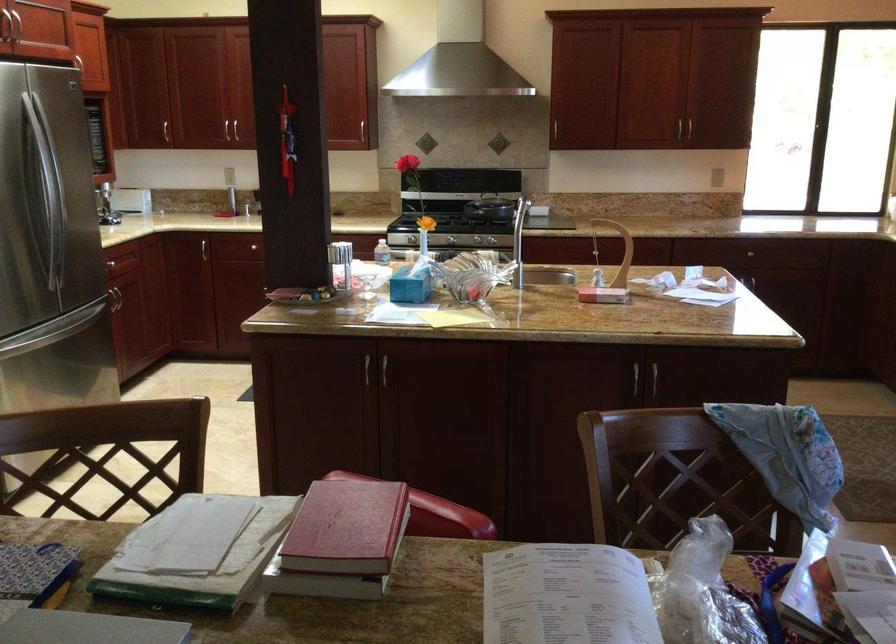
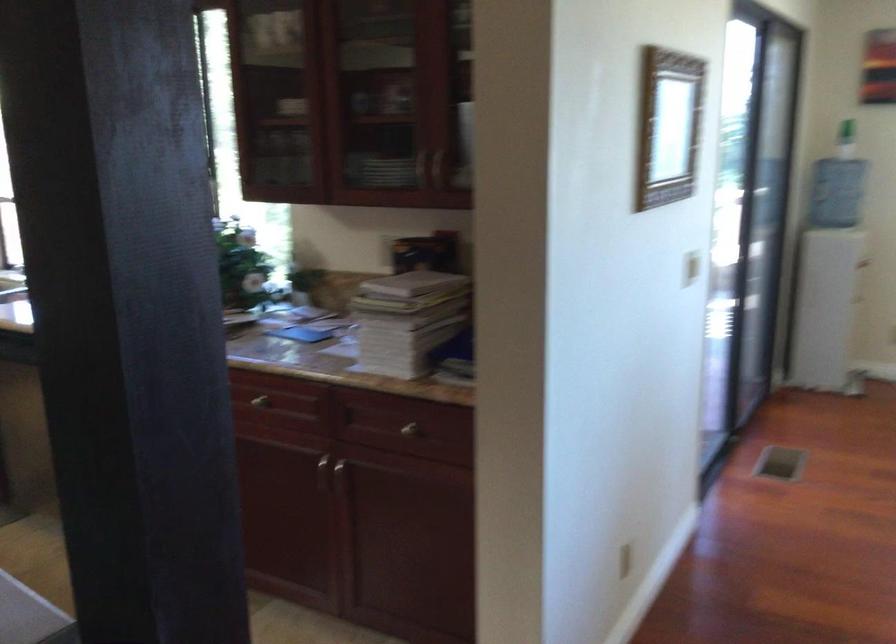
Question: Based on the continuous images, in which direction is the camera rotating? Reply with the corresponding letter.

Choices:
 (A) Left
 (B) Right
 (C) Up
 (D) Down

Answer: (B)